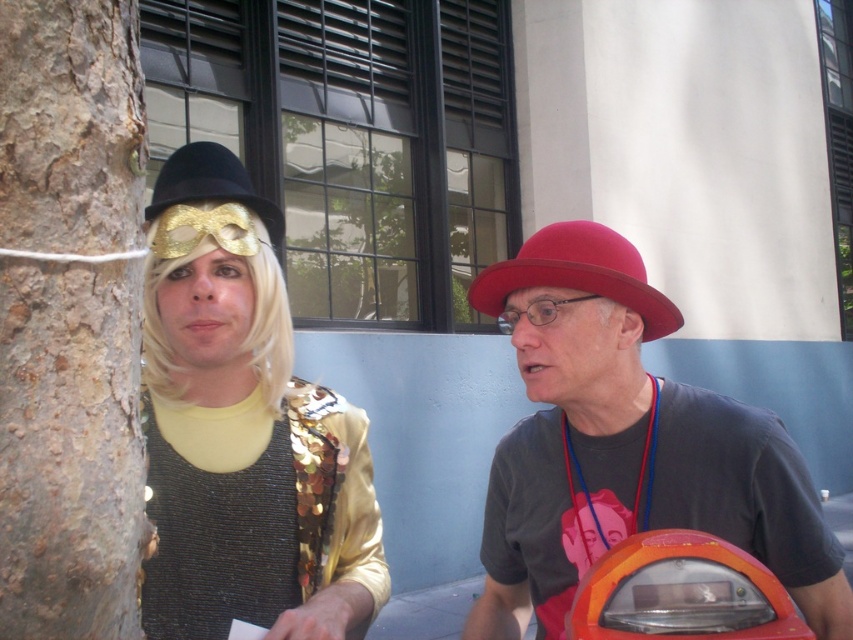
Who is positioned more to the left, shiny gold sequin vest at left or smooth bark tree trunk at left?

From the viewer's perspective, smooth bark tree trunk at left appears more on the left side.

Which is behind, point (509, 536) or point (33, 140)?

The point (509, 536) is behind.

The width and height of the screenshot is (853, 640). I want to click on shiny gold sequin vest at left, so click(247, 449).

You are a GUI agent. You are given a task and a screenshot of the screen. Output one action in this format:
    pyautogui.click(x=<x>, y=<y>)
    Task: Click on the shiny gold sequin vest at left
    
    Given the screenshot: What is the action you would take?
    pyautogui.click(x=247, y=449)

Who is positioned more to the left, shiny gold sequin vest at left or gold sequined hat at upper left?

gold sequined hat at upper left

Between point (318, 628) and point (206, 148), which one is positioned behind?

Positioned behind is point (206, 148).

Locate an element on the screen. shiny gold sequin vest at left is located at coordinates (247, 449).

Which is in front, point (735, 544) or point (212, 198)?

Positioned in front is point (735, 544).

Who is more distant from viewer, (746,496) or (207,144)?

The point (207,144) is more distant.

You are a GUI agent. You are given a task and a screenshot of the screen. Output one action in this format:
    pyautogui.click(x=<x>, y=<y>)
    Task: Click on the matte red hat at center
    The image size is (853, 640).
    Given the screenshot: What is the action you would take?
    pyautogui.click(x=625, y=445)